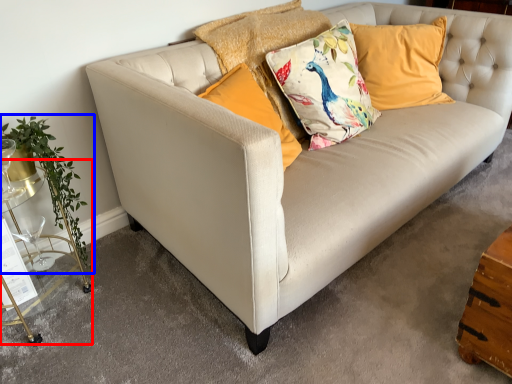
Question: Which of the following is the closest to the observer, table (highlighted by a red box) or plant (highlighted by a blue box)?

Choices:
 (A) table
 (B) plant

Answer: (A)